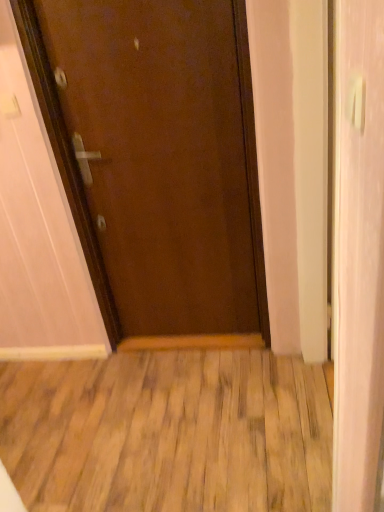
Question: Considering the relative sizes of wooden floor at center and white glossy door at right in the image provided, is wooden floor at center shorter than white glossy door at right?

Choices:
 (A) yes
 (B) no

Answer: (A)

Question: Can you confirm if wooden floor at center is smaller than white glossy door at right?

Choices:
 (A) no
 (B) yes

Answer: (B)

Question: From a real-world perspective, is wooden floor at center positioned over white glossy door at right based on gravity?

Choices:
 (A) no
 (B) yes

Answer: (A)

Question: From a real-world perspective, is wooden floor at center beneath white glossy door at right?

Choices:
 (A) no
 (B) yes

Answer: (B)

Question: From the image's perspective, would you say wooden floor at center is shown under white glossy door at right?

Choices:
 (A) yes
 (B) no

Answer: (A)

Question: Would you say wooden floor at center is outside white glossy door at right?

Choices:
 (A) no
 (B) yes

Answer: (B)

Question: From the image's perspective, is white plastic door handle at upper right on top of wooden floor at center?

Choices:
 (A) no
 (B) yes

Answer: (B)

Question: Is white plastic door handle at upper right positioned beyond the bounds of wooden floor at center?

Choices:
 (A) no
 (B) yes

Answer: (B)

Question: Is wooden floor at center at the back of white plastic door handle at upper right?

Choices:
 (A) no
 (B) yes

Answer: (A)

Question: Does white plastic door handle at upper right appear on the left side of wooden floor at center?

Choices:
 (A) no
 (B) yes

Answer: (A)

Question: From a real-world perspective, is white plastic door handle at upper right under wooden floor at center?

Choices:
 (A) yes
 (B) no

Answer: (B)

Question: Can you see white plastic door handle at upper right touching wooden floor at center?

Choices:
 (A) yes
 (B) no

Answer: (B)

Question: Considering the relative sizes of white plastic door handle at upper right and brown matte door at center in the image provided, is white plastic door handle at upper right thinner than brown matte door at center?

Choices:
 (A) no
 (B) yes

Answer: (B)